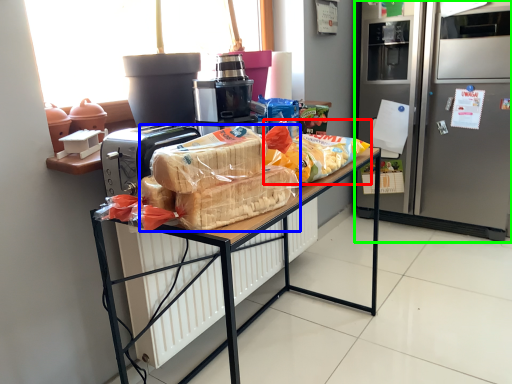
Question: Considering the real-world distances, which object is closest to snack (highlighted by a red box)? snack (highlighted by a blue box) or refrigerator (highlighted by a green box).

Choices:
 (A) snack
 (B) refrigerator

Answer: (A)